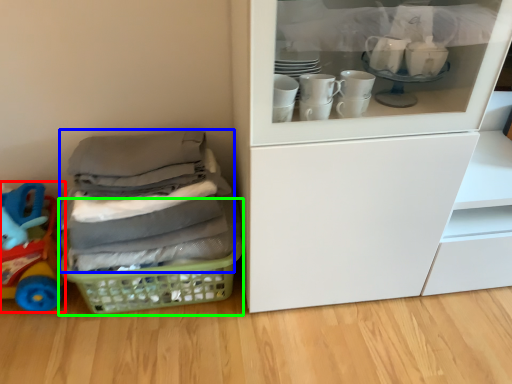
Question: Considering the real-world distances, which object is farthest from toy (highlighted by a red box)? clothing (highlighted by a blue box) or basket (highlighted by a green box)?

Choices:
 (A) clothing
 (B) basket

Answer: (A)